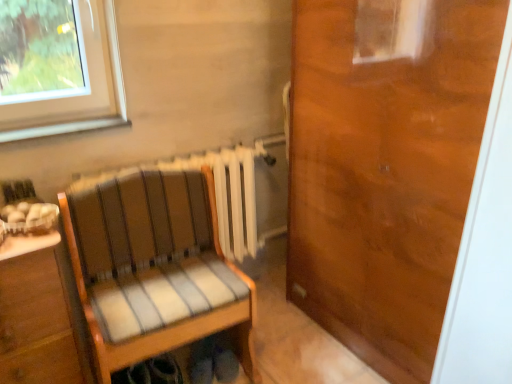
Question: Choose the correct answer: Is striped fabric chair at center inside wooden door at right or outside it?

Choices:
 (A) outside
 (B) inside

Answer: (A)

Question: From a real-world perspective, is striped fabric chair at center above or below wooden door at right?

Choices:
 (A) above
 (B) below

Answer: (B)

Question: Is striped fabric chair at center in front of or behind wooden door at right in the image?

Choices:
 (A) behind
 (B) front

Answer: (A)

Question: Is wooden door at right to the left or to the right of striped fabric chair at center in the image?

Choices:
 (A) right
 (B) left

Answer: (A)

Question: From a real-world perspective, is wooden door at right positioned above or below striped fabric chair at center?

Choices:
 (A) above
 (B) below

Answer: (A)

Question: Based on their sizes in the image, would you say wooden door at right is bigger or smaller than striped fabric chair at center?

Choices:
 (A) small
 (B) big

Answer: (B)

Question: Which is correct: wooden door at right is inside striped fabric chair at center, or outside of it?

Choices:
 (A) outside
 (B) inside

Answer: (A)